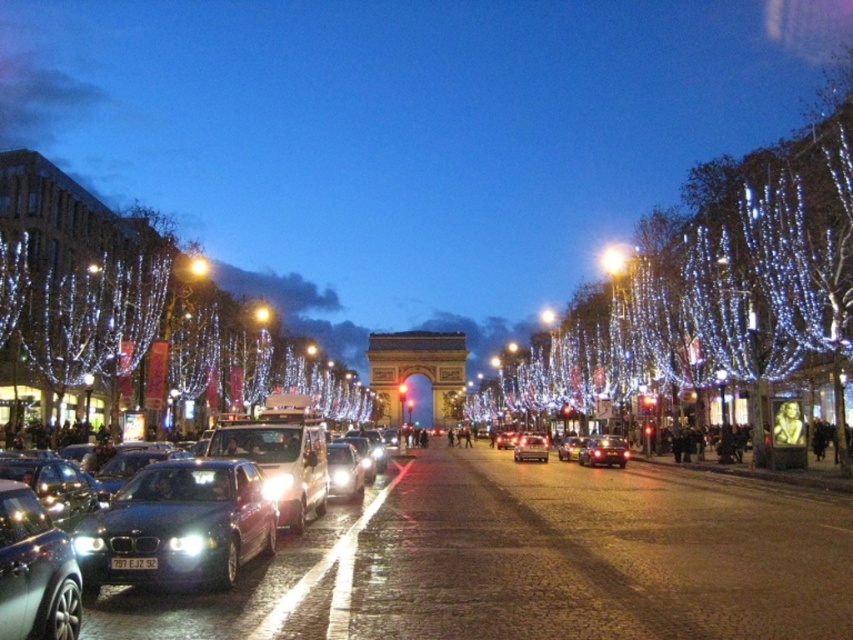
You are a tourist standing at the point labeled as point (241, 586) in the image. You want to take a photo of the Arc de Triomphe which is behind you. Is there any obstruction between you and the Arc de Triomphe?

The sleek metallic car at center is located at point (241, 586), so there is an obstruction between you and the Arc de Triomphe.